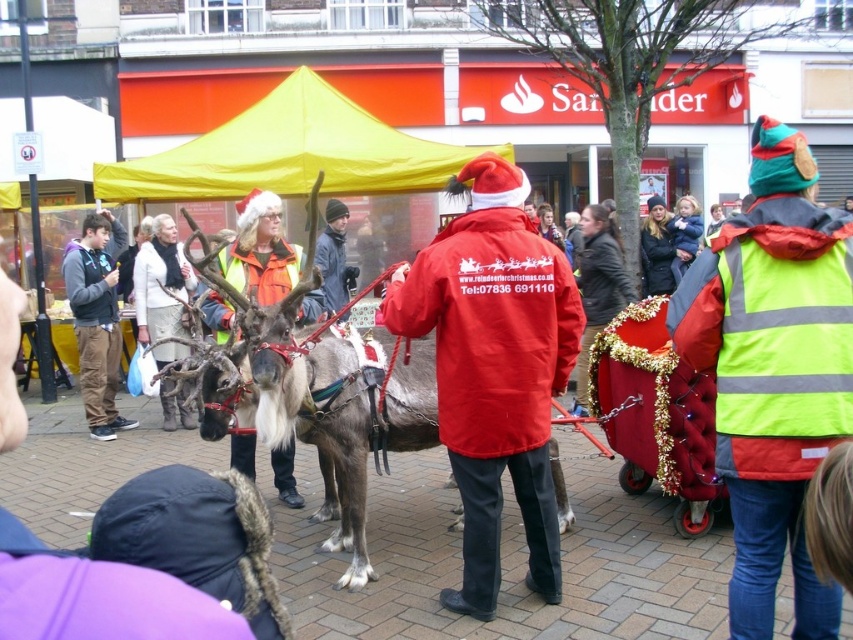
You are a photographer standing in the public square and want to take a photo of both the brown fur reindeer at center and the dark gray fleece jacket at left. Based on their positions, which one should you focus on first to ensure both are in the frame?

The dark gray fleece jacket at left should be focused on first since the brown fur reindeer at center is to the right of it, so adjusting the frame from left to right ensures both are included.

You are standing at the center of the square and see the point marked at coordinates (323, 406). What object is located at that point?

The point at coordinates (323, 406) corresponds to the brown fur reindeer at center.

You are a photographer standing at the edge of the square. You want to take a photo of the red matte coat at center and the brown fur reindeer at center without any obstructions. Given that your camera has a maximum focus range of 30 inches, will you be able to capture both subjects clearly in the same frame?

The distance between the red matte coat at center and the brown fur reindeer at center is 30.16 inches, which exceeds the camera maximum focus range of 30 inches. Therefore, you cannot capture both subjects clearly in the same frame.